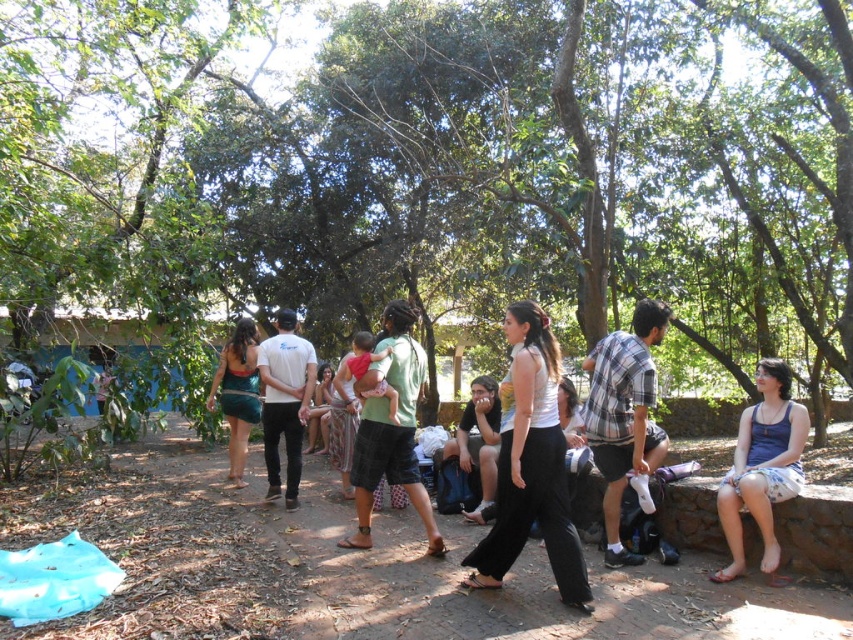
You are standing at the point labeled as point [335,401] in the image. You want to walk towards the point labeled as point [256,340]. In which direction should you move relative to your current position?

You should move forward because point [256,340] is in front of point [335,401].

You are standing at the origin point in the scene. Where is the teal fabric dress at center located?

The teal fabric dress at center is located at point 0.616 on the x axis and 0.280 on the y axis.